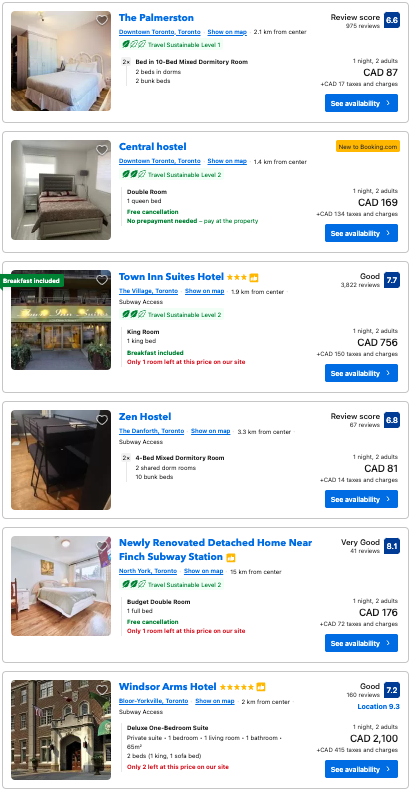
The image size is (413, 792). What are the coordinates of `ladder` in the screenshot? It's located at (35, 466).